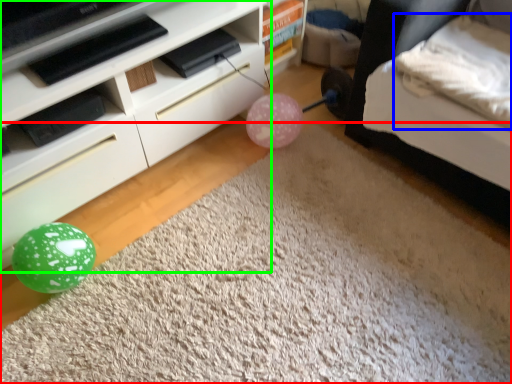
Question: Considering the real-world distances, which object is farthest from plain (highlighted by a red box)? pillow (highlighted by a blue box) or furniture (highlighted by a green box)?

Choices:
 (A) pillow
 (B) furniture

Answer: (A)